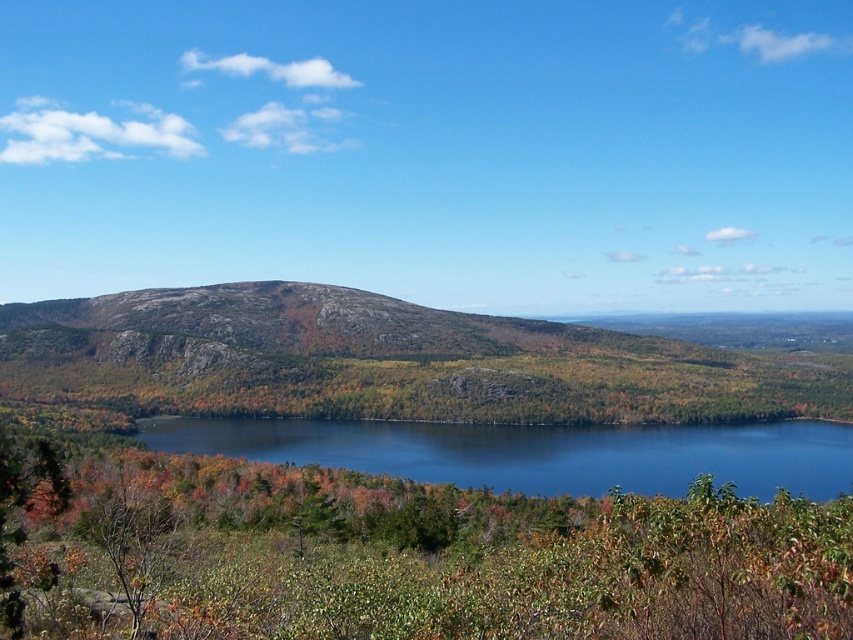
You are standing at the point marked as point (386, 362) in the image. What type of terrain are you currently standing on?

You are standing on rocky terrain at center.

You are standing at the bottom of the hill and want to reach the rocky terrain at center. What direction should you head to reach it?

The rocky terrain at center is located at point (386, 362) in 2D coordinates, so you should head towards the center of the image to reach it.

You are standing at the base of the hill and want to cross the blue liquid water at center to reach the other side. Which direction should you go to avoid the rocky terrain at center?

You should go around the rocky terrain at center by moving to the left or right since the rocky terrain at center is above the blue liquid water at center, meaning the water is below it and accessible on the sides.